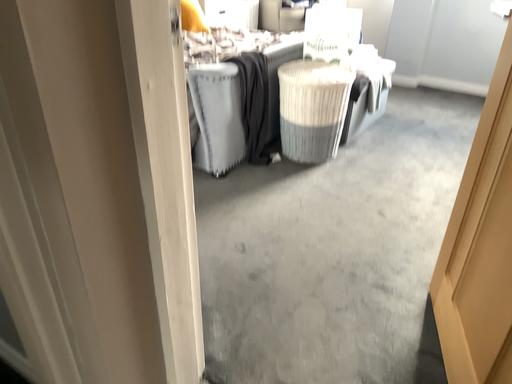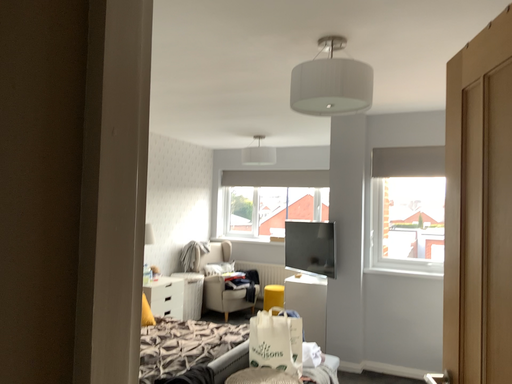
Question: How did the camera likely rotate when shooting the video?

Choices:
 (A) rotated downward
 (B) rotated upward

Answer: (B)